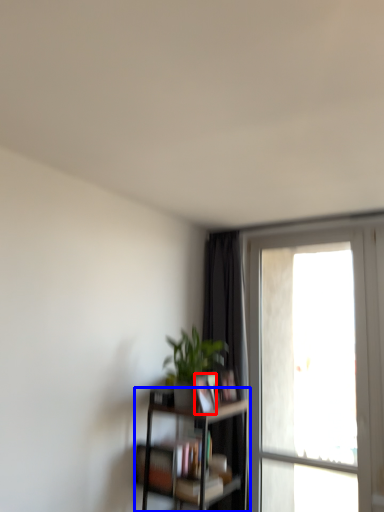
Question: Which object appears farthest to the camera in this image, book (highlighted by a red box) or shelf (highlighted by a blue box)?

Choices:
 (A) book
 (B) shelf

Answer: (A)